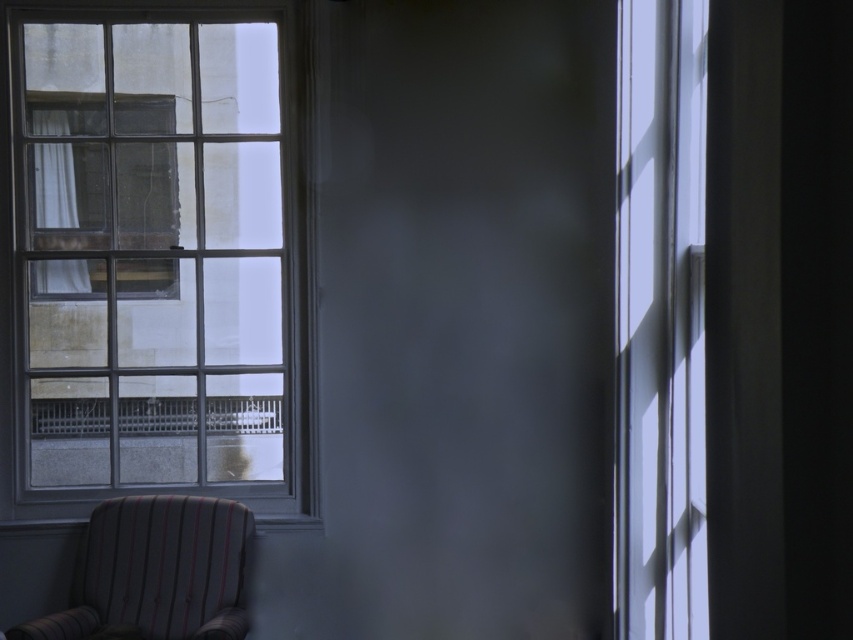
Does clear glass window at left appear on the left side of striped fabric armchair at lower left?

Yes, clear glass window at left is to the left of striped fabric armchair at lower left.

Who is shorter, clear glass window at left or striped fabric armchair at lower left?

striped fabric armchair at lower left

You are a GUI agent. You are given a task and a screenshot of the screen. Output one action in this format:
    pyautogui.click(x=<x>, y=<y>)
    Task: Click on the clear glass window at left
    
    Given the screenshot: What is the action you would take?
    pyautogui.click(x=155, y=256)

Does transparent glass window at right lie behind striped fabric armchair at lower left?

No.

Can you confirm if transparent glass window at right is thinner than striped fabric armchair at lower left?

Correct, transparent glass window at right's width is less than striped fabric armchair at lower left's.

Locate an element on the screen. This screenshot has width=853, height=640. transparent glass window at right is located at coordinates (660, 321).

Where is `transparent glass window at right`? The image size is (853, 640). transparent glass window at right is located at coordinates (660, 321).

Does clear glass window at left have a larger size compared to transparent glass window at right?

Yes, clear glass window at left is bigger than transparent glass window at right.

Who is more forward, (260, 84) or (666, 67)?

Point (666, 67) is more forward.

Between point (144, 429) and point (660, 456), which one is positioned in front?

Positioned in front is point (660, 456).

This screenshot has width=853, height=640. Find the location of `clear glass window at left`. clear glass window at left is located at coordinates (155, 256).